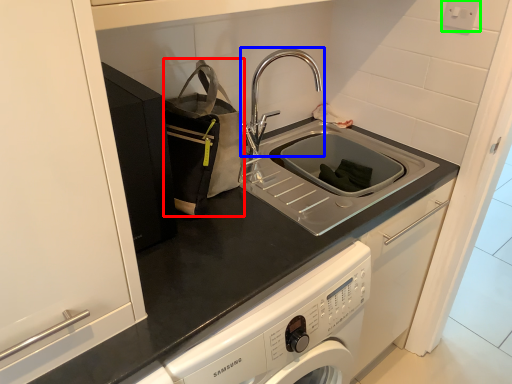
Question: Which is nearer to the bag (highlighted by a red box)? tap (highlighted by a blue box) or electric outlet (highlighted by a green box).

Choices:
 (A) tap
 (B) electric outlet

Answer: (A)